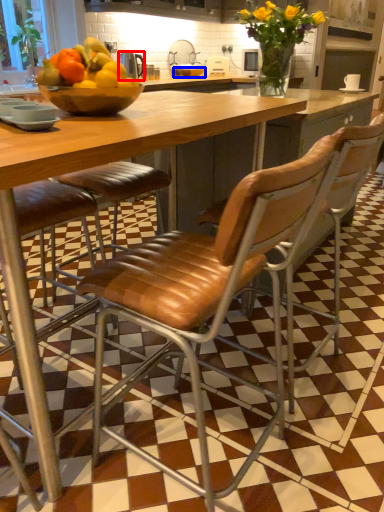
Question: Among these objects, which one is nearest to the camera, appliance (highlighted by a red box) or glass bowl (highlighted by a blue box)?

Choices:
 (A) appliance
 (B) glass bowl

Answer: (A)